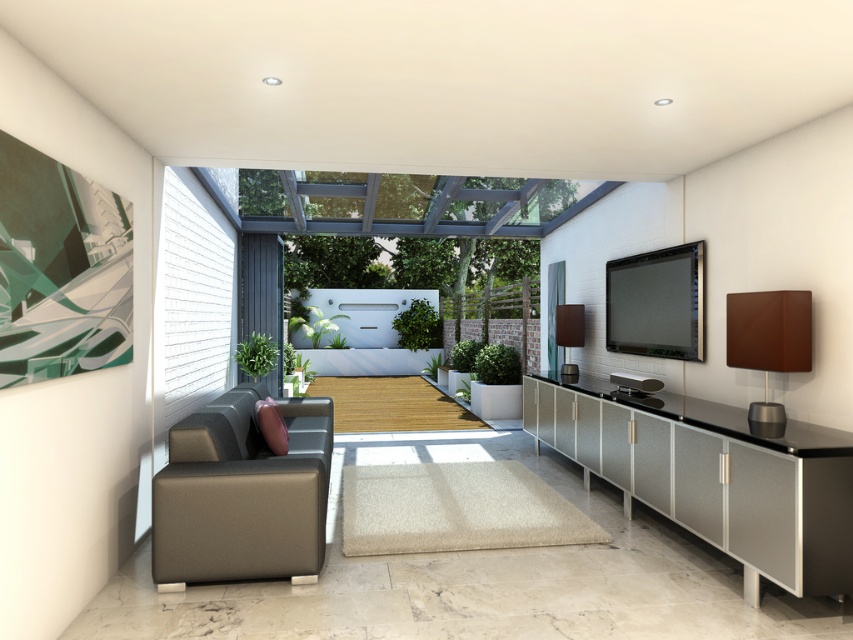
You are standing in the living room and want to place a new potted plant on the floor near the metallic textured cabinet at lower right. Given that the cabinet is positioned at coordinates approximately 0.744 on the x and 0.837 on the y axis, can you estimate where to place the plant relative to the cabinet?

The metallic textured cabinet at lower right is located at point (712, 476), so you should place the potted plant near those coordinates on the floor to position it close to the cabinet.

Looking at this image, you are standing in the living room and want to take a photo of both the point at coordinates point [589,440] and point [196,548]. Which point should you focus on first to ensure both are in focus?

You should focus on point [196,548] first because it is closer to you than point [589,440], which is further away. By focusing on the closer point, the further point will also be in focus due to the depth of field.

You are a guest entering the living room and want to sit on the closest piece of furniture. Which one should you choose between the metallic textured cabinet at lower right and the matte brown leather couch at lower left?

The metallic textured cabinet at lower right is in front of the matte brown leather couch at lower left, so it is closer to you. Therefore, the closest piece of furniture is the metallic textured cabinet at lower right.